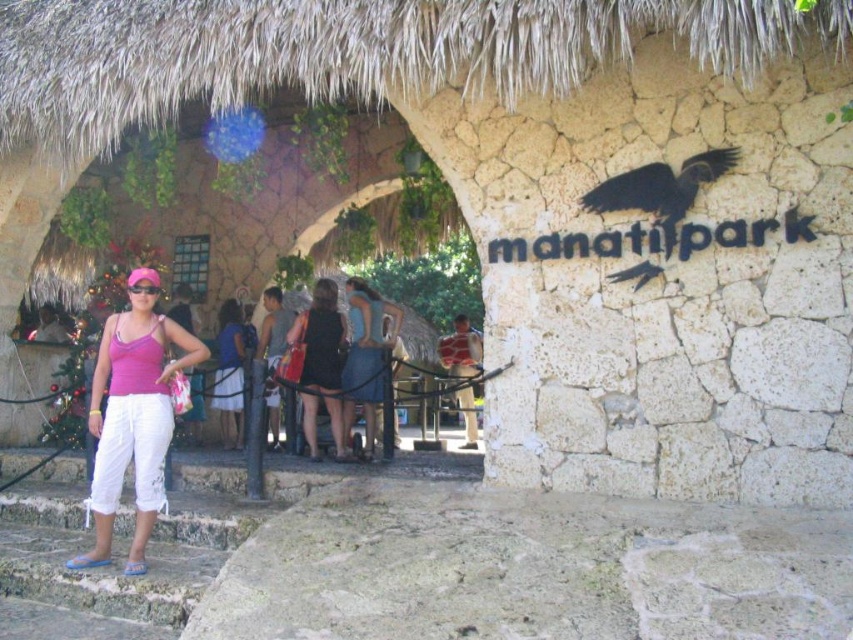
You are a photographer at Manati Park entrance, and you need to capture a closeup shot of the blue denim skirt at center and the black plastic goggles at center. Which object should you zoom in on to ensure both are in focus without moving the camera?

The blue denim skirt at center is wider than the black plastic goggles at center, so you should zoom in on the smaller object, the black plastic goggles at center, to ensure both are in focus without moving the camera.